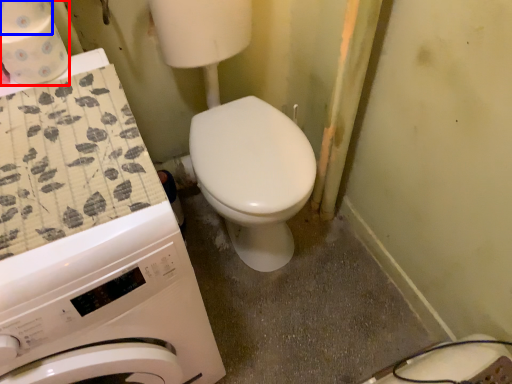
Question: Which object is closer to the camera taking this photo, toilet paper (highlighted by a red box) or toilet paper (highlighted by a blue box)?

Choices:
 (A) toilet paper
 (B) toilet paper

Answer: (B)